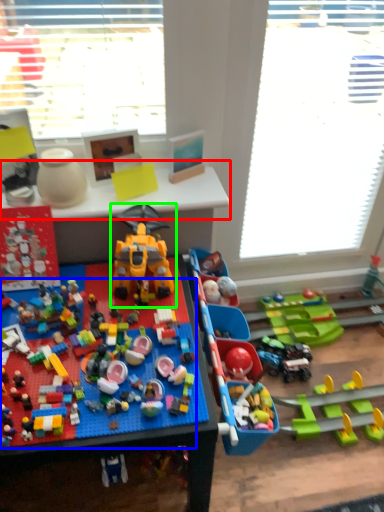
Question: Considering the real-world distances, which object is farthest from table (highlighted by a red box)? toy (highlighted by a blue box) or toy (highlighted by a green box)?

Choices:
 (A) toy
 (B) toy

Answer: (A)